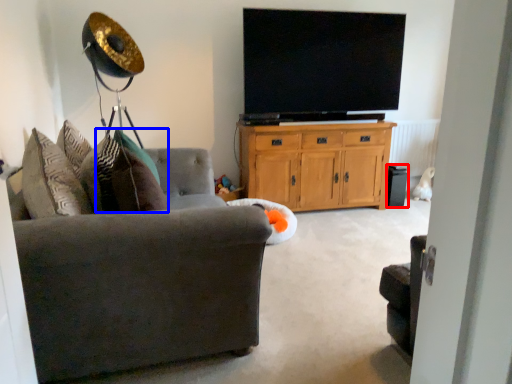
Question: Which object appears farthest to the camera in this image, speaker (highlighted by a red box) or pillow (highlighted by a blue box)?

Choices:
 (A) speaker
 (B) pillow

Answer: (A)